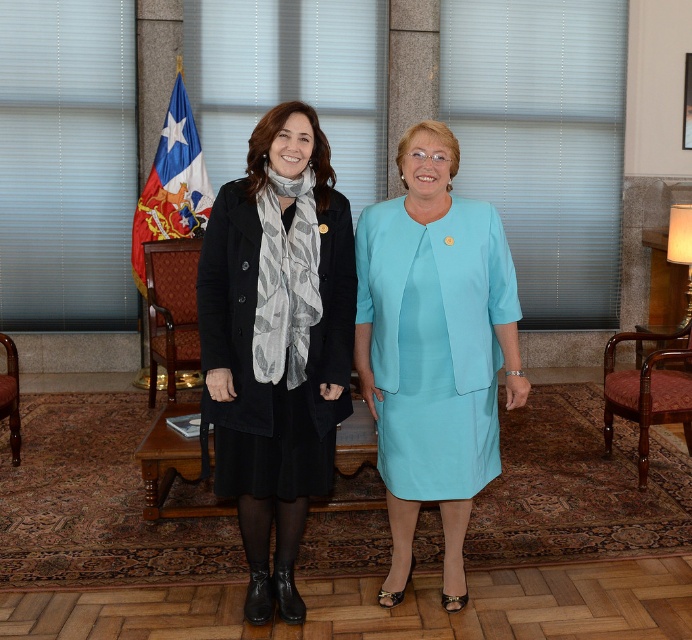
You are standing in the room and want to sit down. There is a black matte coat at center and a wooden armchair at left. Which object is closer to you so you can reach it first?

The black matte coat at center is closer to the viewer than the wooden armchair at left, so you can reach it first.

You are a delivery person who needs to place a package between the black matte coat at center and the wooden armchair at left. The package requires 2 meters of space. Is there enough space?

The distance between the black matte coat at center and the wooden armchair at left is 2.23 meters, which is more than the required 2 meters. Therefore, there is sufficient space to place the package between them.